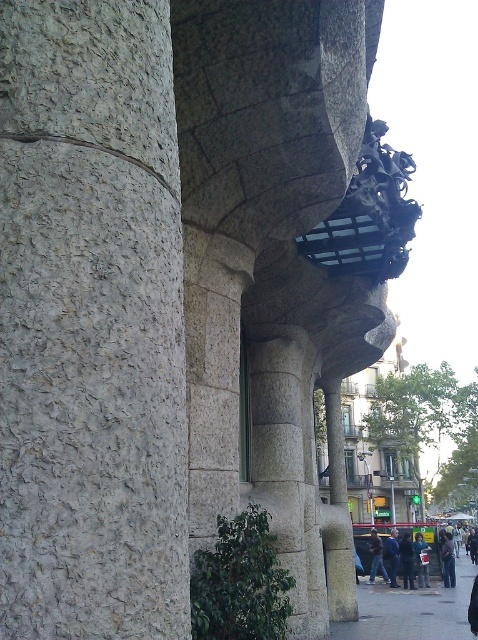
Between point (397, 608) and point (372, 548), which one is positioned behind?

The point (372, 548) is more distant.

Can you confirm if concrete pavement at lower right is positioned to the right of dark blue jeans at center?

Yes, concrete pavement at lower right is to the right of dark blue jeans at center.

Between point (336, 624) and point (369, 577), which one is positioned behind?

The point (369, 577) is behind.

Image resolution: width=478 pixels, height=640 pixels. I want to click on concrete pavement at lower right, so click(x=412, y=611).

Does concrete pavement at lower right appear over dark blue jeans at lower center?

Correct, concrete pavement at lower right is located above dark blue jeans at lower center.

Can you confirm if concrete pavement at lower right is positioned below dark blue jeans at lower center?

Incorrect, concrete pavement at lower right is not positioned below dark blue jeans at lower center.

Does point (428, 604) come in front of point (422, 568)?

Yes, it is in front of point (422, 568).

Image resolution: width=478 pixels, height=640 pixels. What are the coordinates of `concrete pavement at lower right` in the screenshot? It's located at (412, 611).

From the picture: Does dark blue jeans at lower center come in front of dark blue jeans at center?

That is True.

Which is more to the right, dark blue jeans at lower center or dark blue jeans at center?

From the viewer's perspective, dark blue jeans at lower center appears more on the right side.

Which is in front, point (419, 577) or point (388, 577)?

Point (419, 577) is in front.

Identify the location of dark blue jeans at lower center. The width and height of the screenshot is (478, 640). (422, 560).